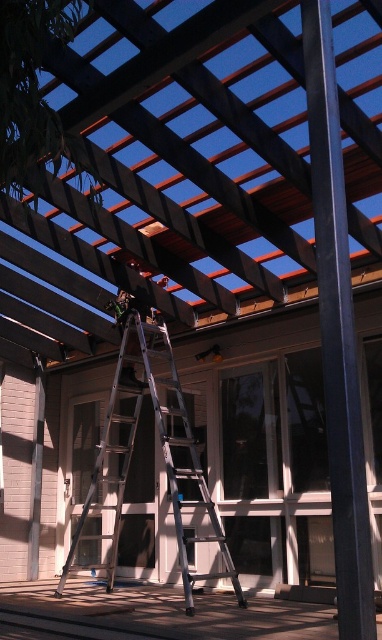
You are standing on the wooden deck at lower center and want to reach the dark brown wooden beams at center to retrieve a tool. Which direction should you move to get there?

The dark brown wooden beams at center are to the right of the wooden deck at lower center, so you should move to the right to reach them.

You are standing at the origin point of the coordinate system. The dark brown wooden beams at center are located at point 0.267, 0.432. If you want to reach them, in which direction should you move?

The dark brown wooden beams at center are located at point (165, 170), so you should move northeast to reach them.